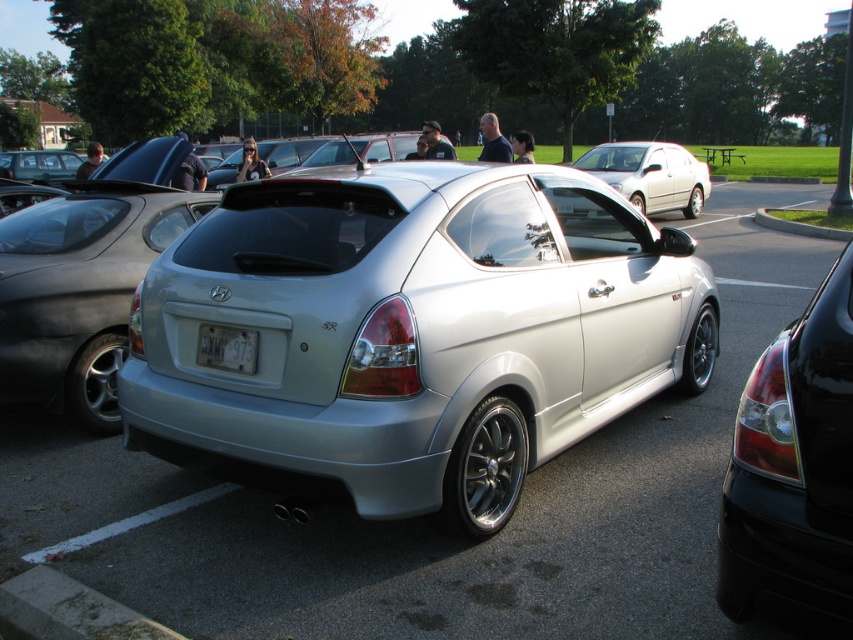
You are a delivery driver who needs to park your vehicle in this parking lot. You see the gray concrete curb at lower left and the white plastic license plate at center. Which object is positioned to the left of the other?

The gray concrete curb at lower left is to the left of the white plastic license plate at center.

You are a delivery driver who needs to park your vehicle between the gray concrete curb at lower left and the satin silver hatchback at center. Is there enough space between them to fit your 1.8 meter wide delivery van?

The gray concrete curb at lower left is positioned on the left side of satin silver hatchback at center. However, the exact distance between them isn not provided in the objects description, so it is unclear if there is sufficient space for the 1.8 meter wide delivery van. Please check the actual distance before attempting to park.

You are standing at the point marked as point (426, 518) in the parking lot. What vehicle are you directly in front of?

The satin silver car at center is located at point (426, 518), so you are directly in front of the satin silver car at center.